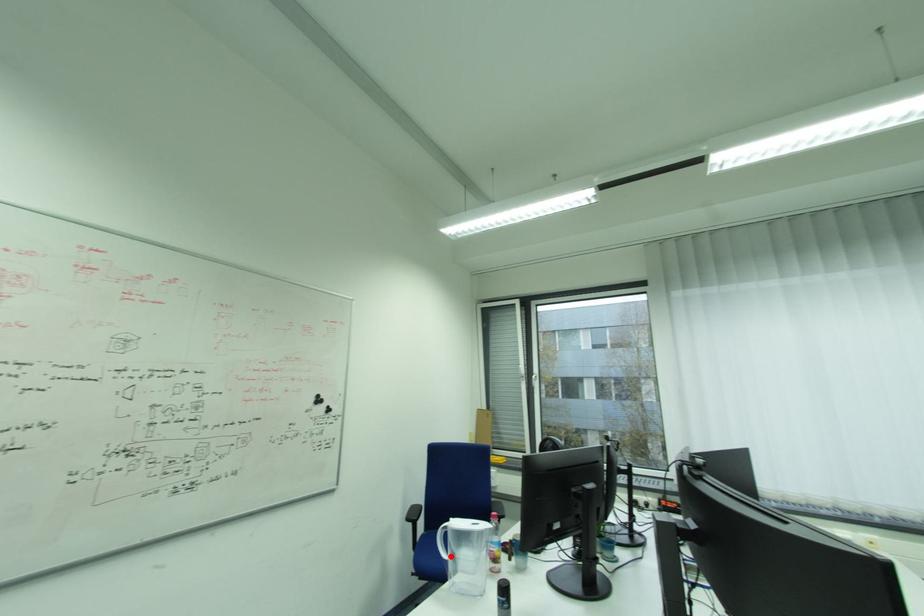
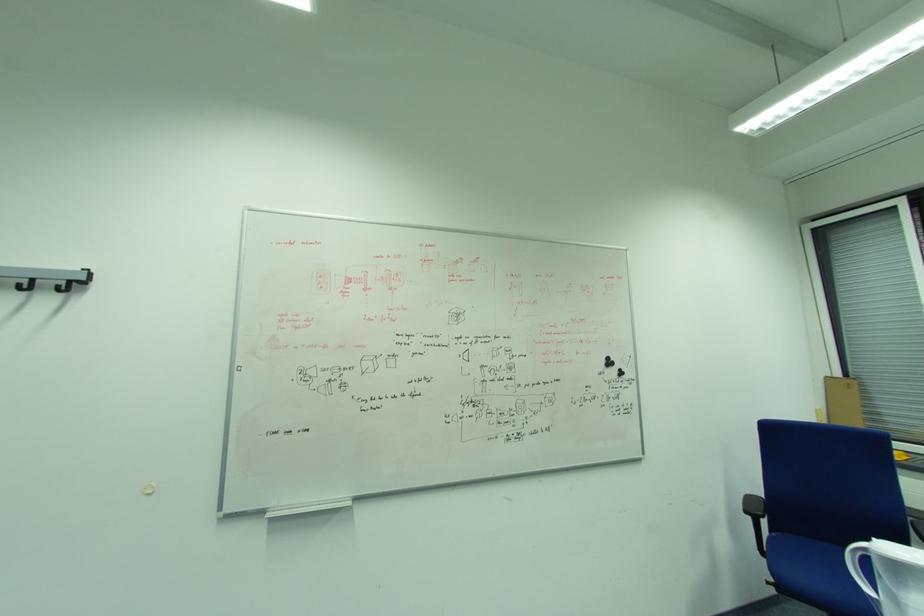
In the second image, find the point that corresponds to the highlighted location in the first image.

(876, 591)